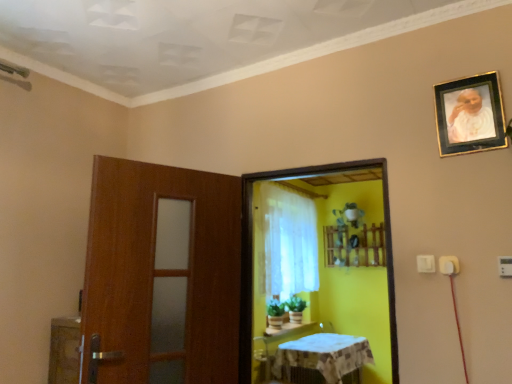
The height and width of the screenshot is (384, 512). What are the coordinates of `white sheer curtain at center` in the screenshot? It's located at (287, 242).

You are a GUI agent. You are given a task and a screenshot of the screen. Output one action in this format:
    pyautogui.click(x=<x>, y=<y>)
    Task: Click on the wooden shelf at center
    The height and width of the screenshot is (384, 512).
    Given the screenshot: What is the action you would take?
    pyautogui.click(x=354, y=246)

What is the approximate width of wooden shelf at center?

The width of wooden shelf at center is 6.62 inches.

What do you see at coordinates (252, 251) in the screenshot?
I see `yellow matte screen door at center` at bounding box center [252, 251].

Measure the distance between point (276, 335) and camera.

A distance of 15.03 feet exists between point (276, 335) and camera.

In order to click on white sheer curtain at center in this screenshot , I will do `click(287, 242)`.

Does white glossy table at lower center appear on the right side of wooden shelf at center?

Incorrect, white glossy table at lower center is not on the right side of wooden shelf at center.

Which object is wider, white glossy table at lower center or wooden shelf at center?

Wider between the two is white glossy table at lower center.

Is white glossy table at lower center inside or outside of wooden shelf at center?

white glossy table at lower center is not enclosed by wooden shelf at center.

Considering the points (252, 379) and (336, 251), which point is in front, point (252, 379) or point (336, 251)?

The point (252, 379) is closer to the camera.

From the image's perspective, is yellow matte screen door at center located beneath white sheer curtain at center?

Incorrect, from the image's perspective, yellow matte screen door at center is higher than white sheer curtain at center.

Is point (244, 316) less distant than point (300, 273)?

Yes, it is in front of point (300, 273).

Considering the relative positions of yellow matte screen door at center and white sheer curtain at center in the image provided, is yellow matte screen door at center to the right of white sheer curtain at center from the viewer's perspective?

In fact, yellow matte screen door at center is to the left of white sheer curtain at center.

Is the depth of yellow matte screen door at center greater than that of white sheer curtain at center?

No, it is in front of white sheer curtain at center.

Find the location of a particular element. This screenshot has height=384, width=512. screen door located in front of the white textured tablecloth at lower center is located at coordinates (252, 251).

From a real-world perspective, which is physically below, white textured tablecloth at lower center or yellow matte screen door at center?

white textured tablecloth at lower center is physically lower.

Considering the relative sizes of white textured tablecloth at lower center and yellow matte screen door at center in the image provided, is white textured tablecloth at lower center wider than yellow matte screen door at center?

Yes.

Between white textured tablecloth at lower center and yellow matte screen door at center, which one has larger size?

Bigger between the two is white textured tablecloth at lower center.

Is yellow matte screen door at center bigger than white glossy table at lower center?

Correct, yellow matte screen door at center is larger in size than white glossy table at lower center.

Is yellow matte screen door at center to the left of white glossy table at lower center from the viewer's perspective?

No.

This screenshot has width=512, height=384. What are the coordinates of `screen door above the white glossy table at lower center (from a real-world perspective)` in the screenshot? It's located at (252, 251).

Considering the positions of points (287, 171) and (270, 374), is point (287, 171) farther from camera compared to point (270, 374)?

No.

From the picture: Is gold-framed photo at upper right turned away from white glossy table at lower center?

No, white glossy table at lower center is not at the back of gold-framed photo at upper right.

Considering the sizes of gold-framed photo at upper right and white glossy table at lower center in the image, is gold-framed photo at upper right taller or shorter than white glossy table at lower center?

In the image, gold-framed photo at upper right appears to be shorter than white glossy table at lower center.

Which object is further away from the camera, gold-framed photo at upper right or white glossy table at lower center?

white glossy table at lower center.

You are a GUI agent. You are given a task and a screenshot of the screen. Output one action in this format:
    pyautogui.click(x=<x>, y=<y>)
    Task: Click on the curtain in front of the wooden shelf at center
    Image resolution: width=512 pixels, height=384 pixels.
    Given the screenshot: What is the action you would take?
    pyautogui.click(x=287, y=242)

Is wooden shelf at center completely or partially inside white sheer curtain at center?

Actually, wooden shelf at center is outside white sheer curtain at center.

Considering the relative sizes of white sheer curtain at center and wooden shelf at center in the image provided, is white sheer curtain at center bigger than wooden shelf at center?

Yes.

Considering the positions of points (483, 144) and (305, 243), is point (483, 144) closer to camera compared to point (305, 243)?

Yes, point (483, 144) is in front of point (305, 243).

What's the angular difference between gold-framed photo at upper right and white sheer curtain at center's facing directions?

gold-framed photo at upper right and white sheer curtain at center are facing 89.2 degrees away from each other.

Is gold-framed photo at upper right taller or shorter than white sheer curtain at center?

Clearly, gold-framed photo at upper right is shorter compared to white sheer curtain at center.

Considering the sizes of objects gold-framed photo at upper right and white sheer curtain at center in the image provided, who is bigger, gold-framed photo at upper right or white sheer curtain at center?

Bigger between the two is white sheer curtain at center.

The width and height of the screenshot is (512, 384). I want to click on table below the wooden shelf at center (from the image's perspective), so (276, 347).

The height and width of the screenshot is (384, 512). What are the coordinates of `curtain behind the yellow matte screen door at center` in the screenshot? It's located at (287, 242).

Considering their positions, is yellow matte screen door at center positioned further to gold-framed photo at upper right than white textured tablecloth at lower center?

white textured tablecloth at lower center lies further to gold-framed photo at upper right than the other object.

Based on their spatial positions, is gold-framed photo at upper right or white textured tablecloth at lower center closer to wooden shelf at center?

Based on the image, white textured tablecloth at lower center appears to be nearer to wooden shelf at center.

Considering their positions, is wooden shelf at center positioned closer to white textured tablecloth at lower center than white sheer curtain at center?

white sheer curtain at center lies closer to white textured tablecloth at lower center than the other object.

Considering their positions, is white glossy table at lower center positioned closer to white sheer curtain at center than gold-framed photo at upper right?

Based on the image, white glossy table at lower center appears to be nearer to white sheer curtain at center.

Consider the image. When comparing their distances from gold-framed photo at upper right, does white textured tablecloth at lower center or wooden shelf at center seem further?

wooden shelf at center lies further to gold-framed photo at upper right than the other object.

Looking at the image, which one is located further to yellow matte screen door at center, white textured tablecloth at lower center or wooden shelf at center?

wooden shelf at center.

When comparing their distances from gold-framed photo at upper right, does yellow matte screen door at center or white glossy table at lower center seem closer?

yellow matte screen door at center lies closer to gold-framed photo at upper right than the other object.

When comparing their distances from white glossy table at lower center, does wooden shelf at center or yellow matte screen door at center seem further?

Based on the image, yellow matte screen door at center appears to be further to white glossy table at lower center.

Where is `curtain between gold-framed photo at upper right and wooden shelf at center from front to back`? The image size is (512, 384). curtain between gold-framed photo at upper right and wooden shelf at center from front to back is located at coordinates (287, 242).

Where is `screen door between gold-framed photo at upper right and white glossy table at lower center from front to back`? The height and width of the screenshot is (384, 512). screen door between gold-framed photo at upper right and white glossy table at lower center from front to back is located at coordinates (252, 251).

Locate an element on the screen. furniture between gold-framed photo at upper right and wooden shelf at center from front to back is located at coordinates (324, 355).

Where is `table between white sheer curtain at center and white textured tablecloth at lower center vertically`? table between white sheer curtain at center and white textured tablecloth at lower center vertically is located at coordinates (276, 347).